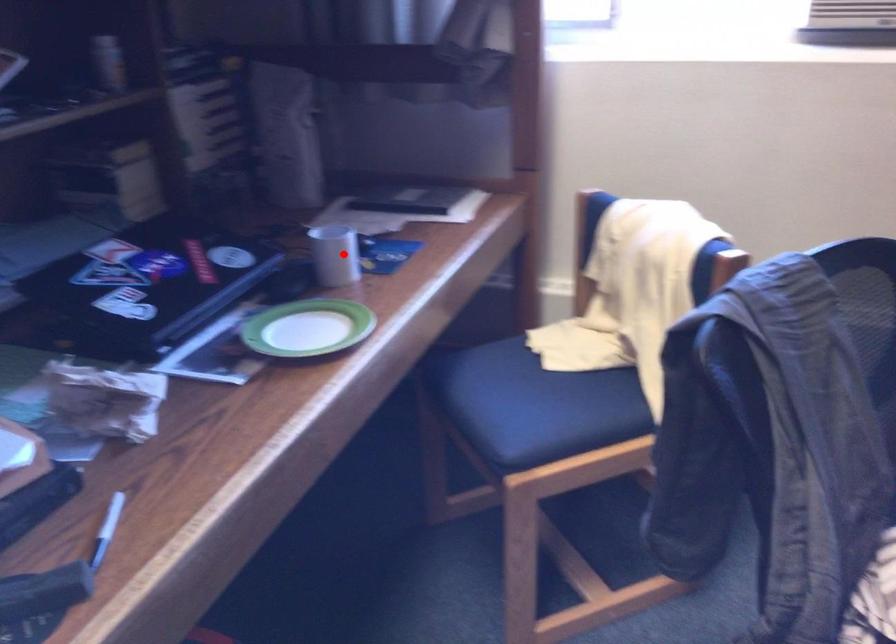
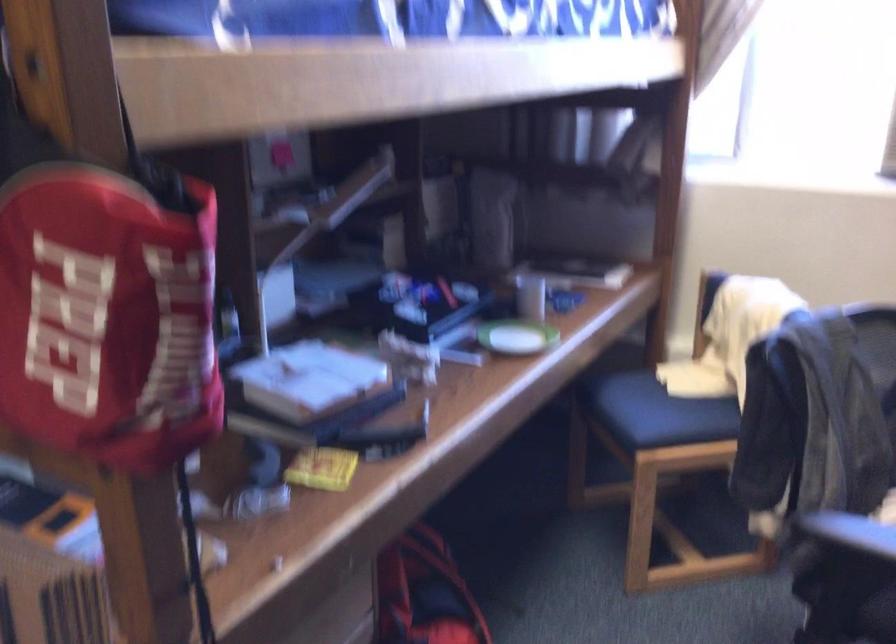
The point at the highlighted location is marked in the first image. Where is the corresponding point in the second image?

(530, 297)